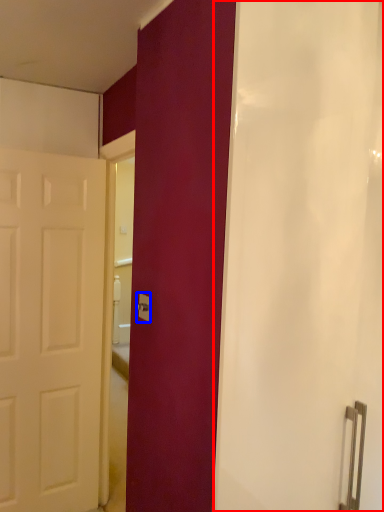
Question: Which of the following is the closest to the observer, shower curtain (highlighted by a red box) or electric outlet (highlighted by a blue box)?

Choices:
 (A) shower curtain
 (B) electric outlet

Answer: (A)